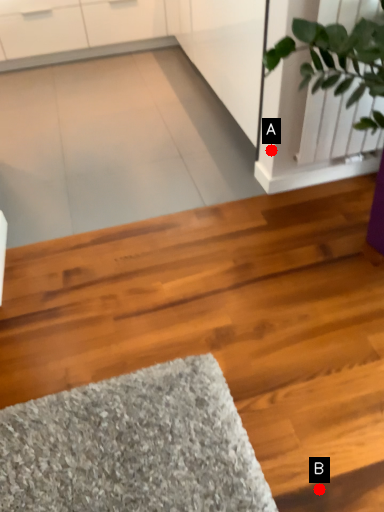
Question: Two points are circled on the image, labeled by A and B beside each circle. Which point is closer to the camera taking this photo?

Choices:
 (A) A is closer
 (B) B is closer

Answer: (B)